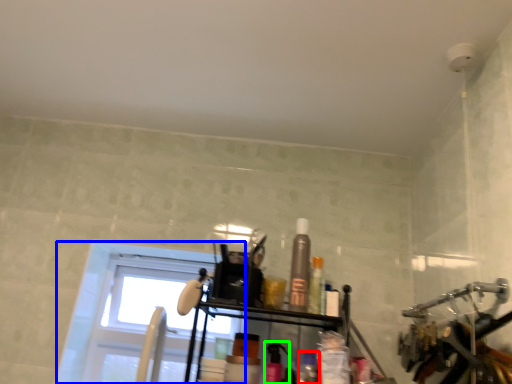
Question: Which object is the farthest from toiletry (highlighted by a red box)? Choose among these: window (highlighted by a blue box) or toiletry (highlighted by a green box).

Choices:
 (A) window
 (B) toiletry

Answer: (A)